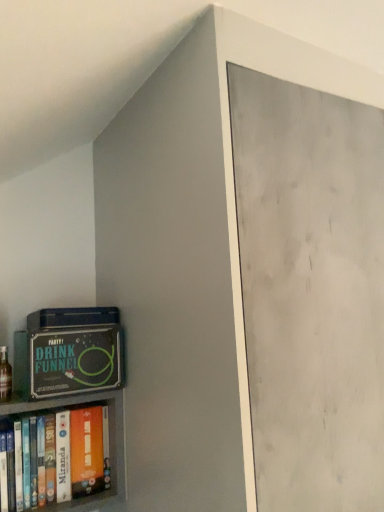
Question: Is green matte board game at lower left completely or partially outside of orange matte book at lower left?

Choices:
 (A) yes
 (B) no

Answer: (A)

Question: Is green matte board game at lower left wider than orange matte book at lower left?

Choices:
 (A) no
 (B) yes

Answer: (B)

Question: Is green matte board game at lower left bigger than orange matte book at lower left?

Choices:
 (A) yes
 (B) no

Answer: (A)

Question: Are green matte board game at lower left and orange matte book at lower left beside each other?

Choices:
 (A) yes
 (B) no

Answer: (B)

Question: Considering the relative sizes of green matte board game at lower left and orange matte book at lower left in the image provided, is green matte board game at lower left thinner than orange matte book at lower left?

Choices:
 (A) no
 (B) yes

Answer: (A)

Question: Considering the relative positions of green matte board game at lower left and orange matte book at lower left in the image provided, is green matte board game at lower left in front of orange matte book at lower left?

Choices:
 (A) no
 (B) yes

Answer: (B)

Question: Is green matte board game at lower left not near translucent glass bottle at lower left?

Choices:
 (A) no
 (B) yes

Answer: (A)

Question: Is green matte board game at lower left closer to the viewer compared to translucent glass bottle at lower left?

Choices:
 (A) no
 (B) yes

Answer: (B)

Question: Is green matte board game at lower left smaller than translucent glass bottle at lower left?

Choices:
 (A) yes
 (B) no

Answer: (B)

Question: From a real-world perspective, is green matte board game at lower left positioned under translucent glass bottle at lower left based on gravity?

Choices:
 (A) no
 (B) yes

Answer: (A)

Question: From the image's perspective, is green matte board game at lower left on top of translucent glass bottle at lower left?

Choices:
 (A) yes
 (B) no

Answer: (A)

Question: Is green matte board game at lower left beside translucent glass bottle at lower left?

Choices:
 (A) yes
 (B) no

Answer: (B)

Question: Is translucent glass bottle at lower left far from orange matte book at lower left?

Choices:
 (A) no
 (B) yes

Answer: (A)